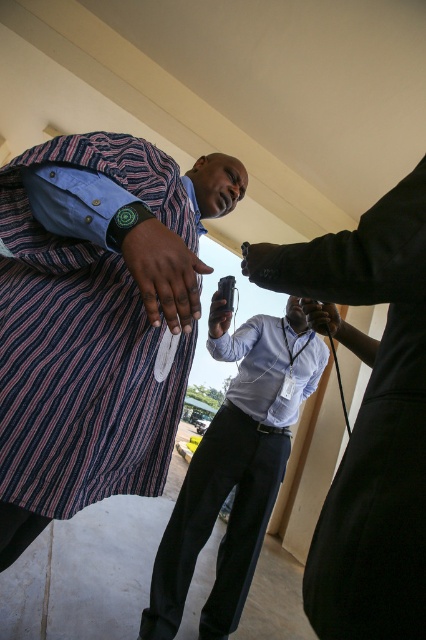
Question: Which object is positioned closest to the black matte camera at center?

Choices:
 (A) matte black suit at upper right
 (B) matte black phone at center

Answer: (A)

Question: Is matte black camera at center bigger than matte black phone at center?

Choices:
 (A) yes
 (B) no

Answer: (B)

Question: In this image, where is matte black camera at center located relative to black matte camera at center?

Choices:
 (A) left
 (B) right

Answer: (B)

Question: Can you confirm if dark brown leather hand at center is positioned to the right of matte black phone at center?

Choices:
 (A) yes
 (B) no

Answer: (B)

Question: Which object is positioned closest to the black matte camera at center?

Choices:
 (A) matte black suit at upper right
 (B) striped fabric dress at center
 (C) matte black phone at center

Answer: (A)

Question: Which of these objects is positioned closest to the black matte camera at center?

Choices:
 (A) matte black phone at center
 (B) matte black camera at center

Answer: (B)